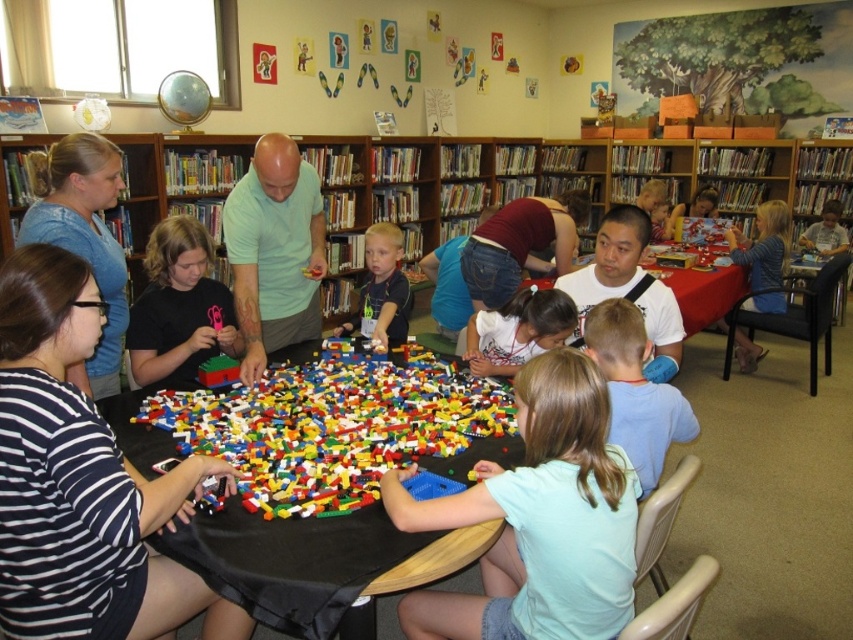
You are a participant in the LEGO workshop and need to reach the blue cotton shirt at lower center to ask a question. Is the black fabric table at center blocking your path?

The black fabric table at center is in front of the blue cotton shirt at lower center, so the table is blocking the path to the blue cotton shirt at lower center.

You are a photographer standing in front of the round table with the black cloth. You want to take a photo of the light green shirt at center and the smooth blue shirt at center so that both are clearly visible. Based on their positions, which shirt should you focus on first to ensure both are in frame?

The light green shirt at center is positioned on the left side of smooth blue shirt at center. To ensure both are in frame, focus on the light green shirt at center first as it is on the left, then adjust to include the smooth blue shirt at center on the right.